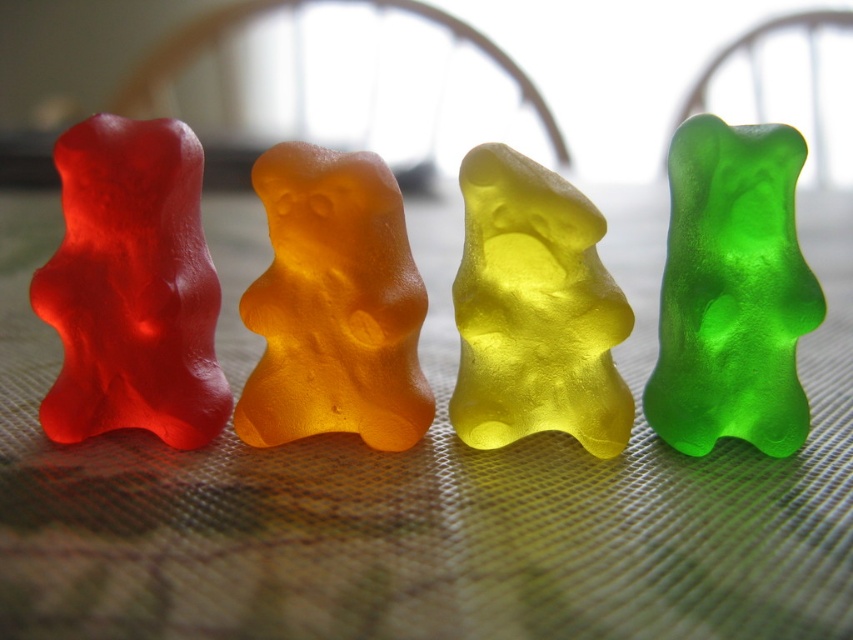
Locate an element on the screen. matte translucent gummy bear at left is located at coordinates (131, 288).

Measure the distance between matte translucent gummy bear at left and translucent orange gummy bear at center.

matte translucent gummy bear at left and translucent orange gummy bear at center are 12.68 centimeters apart from each other.

Find the location of a particular element. Image resolution: width=853 pixels, height=640 pixels. matte translucent gummy bear at left is located at coordinates (131, 288).

Between translucent gelatin gummy bears at center and matte translucent gummy bear at left, which one appears on the right side from the viewer's perspective?

Positioned to the right is translucent gelatin gummy bears at center.

Can you confirm if translucent gelatin gummy bears at center is wider than matte translucent gummy bear at left?

Indeed, translucent gelatin gummy bears at center has a greater width compared to matte translucent gummy bear at left.

Is point (518, 541) less distant than point (210, 392)?

Yes, point (518, 541) is closer to viewer.

This screenshot has height=640, width=853. In order to click on translucent gelatin gummy bears at center in this screenshot , I will do `click(431, 492)`.

Can you confirm if translucent gelatin gummy bears at center is taller than green translucent gummy bear at right?

Correct, translucent gelatin gummy bears at center is much taller as green translucent gummy bear at right.

In order to click on translucent gelatin gummy bears at center in this screenshot , I will do `click(431, 492)`.

I want to click on translucent gelatin gummy bears at center, so click(x=431, y=492).